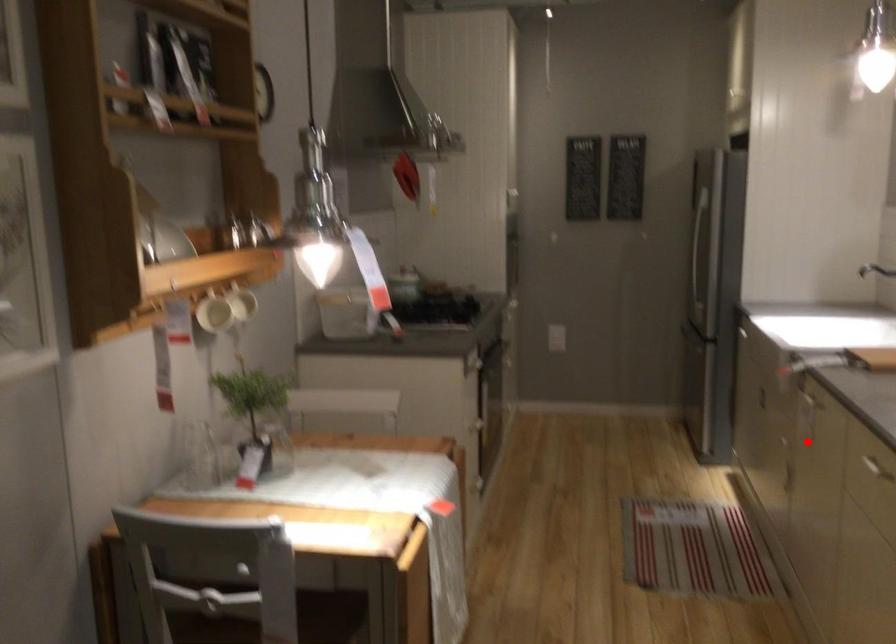
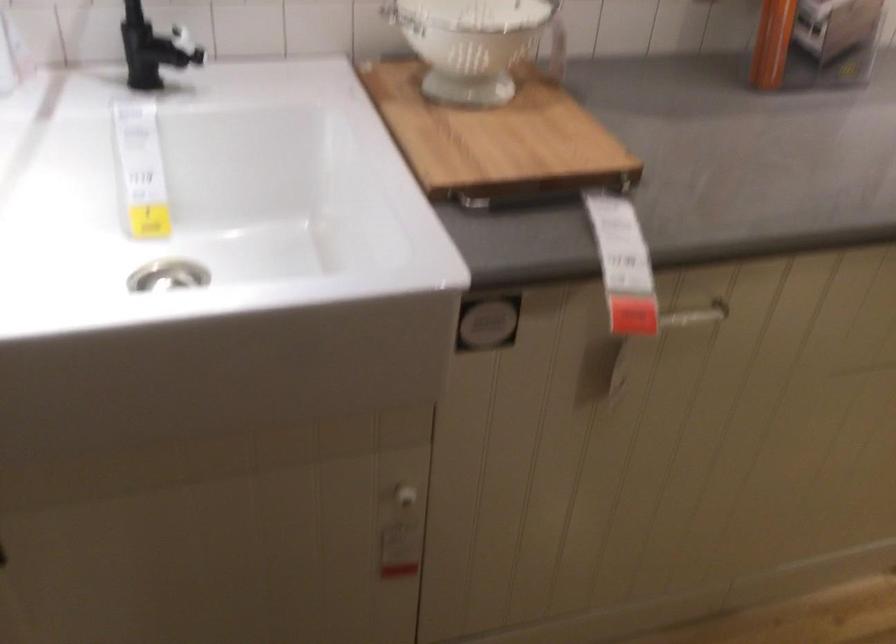
Where in the second image is the point corresponding to the highlighted location from the first image?

(403, 497)